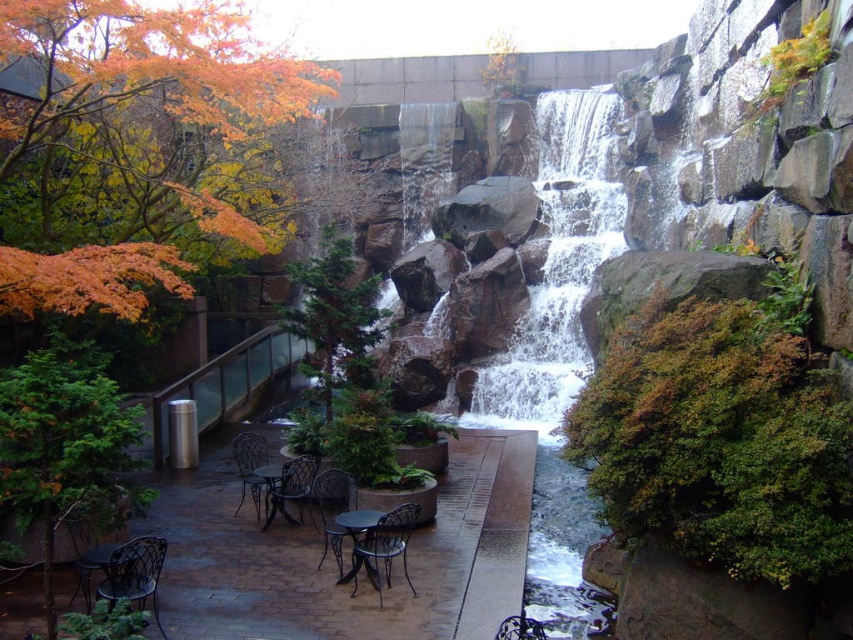
Is metallic dark brown chair at center taller than brown wooden table at center?

No, metallic dark brown chair at center is not taller than brown wooden table at center.

Measure the distance between metallic dark brown chair at center and camera.

They are 122.84 feet apart.

This screenshot has height=640, width=853. What do you see at coordinates (329, 509) in the screenshot? I see `metallic dark brown chair at center` at bounding box center [329, 509].

What are the coordinates of `metallic dark brown chair at center` in the screenshot? It's located at (329, 509).

Can you confirm if brown wooden table at center is thinner than metallic black chair at lower center?

In fact, brown wooden table at center might be wider than metallic black chair at lower center.

Does brown wooden table at center have a smaller size compared to metallic black chair at lower center?

Actually, brown wooden table at center might be larger than metallic black chair at lower center.

Locate an element on the screen. The image size is (853, 640). brown wooden table at center is located at coordinates (273, 492).

Is metallic dark brown chair at lower left wider than green metal table at center?

Yes, metallic dark brown chair at lower left is wider than green metal table at center.

Between point (158, 627) and point (337, 515), which one is positioned in front?

Point (158, 627) is more forward.

The image size is (853, 640). I want to click on metallic dark brown chair at lower left, so click(134, 573).